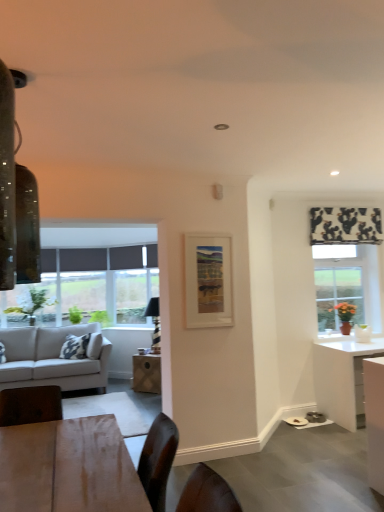
Where is `white glossy cabinet at lower right`? white glossy cabinet at lower right is located at coordinates (375, 420).

Describe the element at coordinates (375, 420) in the screenshot. The height and width of the screenshot is (512, 384). I see `white glossy cabinet at lower right` at that location.

The width and height of the screenshot is (384, 512). What do you see at coordinates (208, 281) in the screenshot?
I see `matte wooden picture frame at center` at bounding box center [208, 281].

The width and height of the screenshot is (384, 512). What do you see at coordinates (345, 225) in the screenshot? I see `black and white fabric at upper right` at bounding box center [345, 225].

The width and height of the screenshot is (384, 512). Identify the location of green matte plant at right. (x=345, y=316).

Find the location of `white glossy desk at right`. white glossy desk at right is located at coordinates (343, 379).

From the picture: Does wooden table at center have a lesser height compared to white glossy cabinet at lower right?

Yes.

Between wooden table at center and white glossy cabinet at lower right, which one is positioned in front?

white glossy cabinet at lower right.

Considering the sizes of wooden table at center and white glossy cabinet at lower right in the image, is wooden table at center bigger or smaller than white glossy cabinet at lower right?

Considering their sizes, wooden table at center takes up more space than white glossy cabinet at lower right.

Choose the correct answer: Is light gray fabric couch at left inside white glossy desk at right or outside it?

light gray fabric couch at left is not inside white glossy desk at right, it's outside.

From the image's perspective, is light gray fabric couch at left above or below white glossy desk at right?

light gray fabric couch at left is situated lower than white glossy desk at right in the image.

Between light gray fabric couch at left and white glossy desk at right, which one has larger size?

light gray fabric couch at left.

Is black and white fabric at upper right thinner than green matte plant at right?

Indeed, black and white fabric at upper right has a lesser width compared to green matte plant at right.

Is point (379, 234) positioned before point (351, 309)?

That is True.

How many degrees apart are the facing directions of black and white fabric at upper right and green matte plant at right?

There is a 1.78-degree angle between the facing directions of black and white fabric at upper right and green matte plant at right.

You are a GUI agent. You are given a task and a screenshot of the screen. Output one action in this format:
    pyautogui.click(x=<x>, y=<y>)
    Task: Click on the houseplant located in front of the black and white fabric at upper right
    This screenshot has height=512, width=384.
    Given the screenshot: What is the action you would take?
    pyautogui.click(x=345, y=316)

From the image's perspective, is white glossy desk at right beneath white glossy cabinet at lower right?

Yes, from the image's perspective, white glossy desk at right is below white glossy cabinet at lower right.

Is the depth of white glossy desk at right greater than that of white glossy cabinet at lower right?

Yes, it is.

Is white glossy desk at right facing away from white glossy cabinet at lower right?

No, white glossy desk at right's orientation is not away from white glossy cabinet at lower right.

From a real-world perspective, is white glossy desk at right physically above white glossy cabinet at lower right?

No, from a real-world perspective, white glossy desk at right is not over white glossy cabinet at lower right

Would you say matte wooden picture frame at center is a long distance from wooden table at center?

matte wooden picture frame at center is far away from wooden table at center.

Which is more to the left, matte wooden picture frame at center or wooden table at center?

wooden table at center.

Is matte wooden picture frame at center bigger than wooden table at center?

No, matte wooden picture frame at center is not bigger than wooden table at center.

Based on the photo, does white glossy desk at right appear on the right side of matte wooden picture frame at center?

Correct, you'll find white glossy desk at right to the right of matte wooden picture frame at center.

Is white glossy desk at right wider than matte wooden picture frame at center?

Yes.

Is white glossy desk at right bigger or smaller than matte wooden picture frame at center?

white glossy desk at right is bigger than matte wooden picture frame at center.

From a real-world perspective, relative to matte wooden picture frame at center, is white glossy desk at right vertically above or below?

Clearly, from a real-world perspective, white glossy desk at right is below matte wooden picture frame at center.

Between white glossy cabinet at lower right and light gray fabric couch at left, which one has smaller size?

With smaller size is white glossy cabinet at lower right.

Locate an element on the screen. The width and height of the screenshot is (384, 512). cabinetry that is in front of the light gray fabric couch at left is located at coordinates (375, 420).

From a real-world perspective, is white glossy cabinet at lower right physically located above or below light gray fabric couch at left?

Clearly, from a real-world perspective, white glossy cabinet at lower right is below light gray fabric couch at left.

Is light gray fabric couch at left located within white glossy cabinet at lower right?

That's incorrect, light gray fabric couch at left is not inside white glossy cabinet at lower right.

I want to click on table on the left of white glossy cabinet at lower right, so click(x=147, y=373).

The height and width of the screenshot is (512, 384). Identify the location of studio couch that appears below the white glossy desk at right (from the image's perspective). (53, 358).

Consider the image. Considering their positions, is green matte plant at right positioned further to wooden table at center than white glossy cabinet at lower right?

The object further to wooden table at center is white glossy cabinet at lower right.

Considering their positions, is green matte plant at right positioned further to matte wooden picture frame at center than wooden table at center?

The object further to matte wooden picture frame at center is green matte plant at right.

Based on the photo, from the image, which object appears to be nearer to wooden table at center, matte wooden picture frame at center or light gray fabric couch at left?

The object closer to wooden table at center is light gray fabric couch at left.

Estimate the real-world distances between objects in this image. Which object is further from white glossy desk at right, green matte plant at right or black and white fabric at upper right?

Among the two, black and white fabric at upper right is located further to white glossy desk at right.

Based on their spatial positions, is black and white fabric at upper right or green matte plant at right closer to white glossy desk at right?

green matte plant at right.

Based on the photo, which object lies further to the anchor point matte wooden picture frame at center, light gray fabric couch at left or green matte plant at right?

green matte plant at right lies further to matte wooden picture frame at center than the other object.

From the image, which object appears to be farther from light gray fabric couch at left, white glossy desk at right or black and white fabric at upper right?

black and white fabric at upper right is further to light gray fabric couch at left.

When comparing their distances from wooden table at center, does matte wooden picture frame at center or green matte plant at right seem further?

Among the two, green matte plant at right is located further to wooden table at center.

The height and width of the screenshot is (512, 384). Find the location of `curtain located between light gray fabric couch at left and green matte plant at right in the left-right direction`. curtain located between light gray fabric couch at left and green matte plant at right in the left-right direction is located at coordinates (345, 225).

You are a GUI agent. You are given a task and a screenshot of the screen. Output one action in this format:
    pyautogui.click(x=<x>, y=<y>)
    Task: Click on the cabinetry between black and white fabric at upper right and white glossy desk at right in the vertical direction
    
    Given the screenshot: What is the action you would take?
    pyautogui.click(x=375, y=420)

This screenshot has width=384, height=512. I want to click on desk located between white glossy cabinet at lower right and wooden table at center in the depth direction, so click(x=343, y=379).

Find the location of `houseplant situated between light gray fabric couch at left and white glossy desk at right from left to right`. houseplant situated between light gray fabric couch at left and white glossy desk at right from left to right is located at coordinates (345, 316).